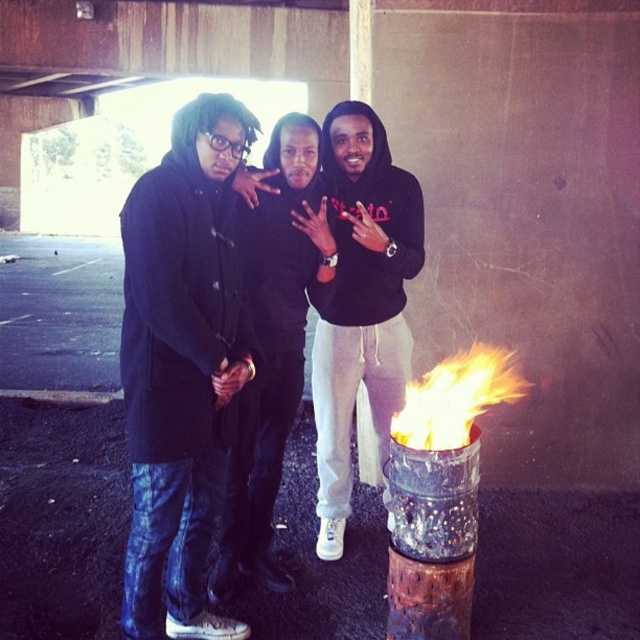
Question: Is denim jacket at left smaller than black hoodie at center?

Choices:
 (A) yes
 (B) no

Answer: (A)

Question: Which point is farther from the camera taking this photo?

Choices:
 (A) (500, 364)
 (B) (148, 346)
 (C) (349, 129)

Answer: (A)

Question: Does denim jacket at left come behind flamefluffyfire at lower center?

Choices:
 (A) no
 (B) yes

Answer: (A)

Question: Where is black hoodie at center located in relation to flamefluffyfire at lower center in the image?

Choices:
 (A) below
 (B) above

Answer: (B)

Question: Which point is closer to the camera taking this photo?

Choices:
 (A) (330, 161)
 (B) (212, 186)

Answer: (B)

Question: Which point is farther to the camera?

Choices:
 (A) black hoodie at center
 (B) denim jacket at left

Answer: (A)